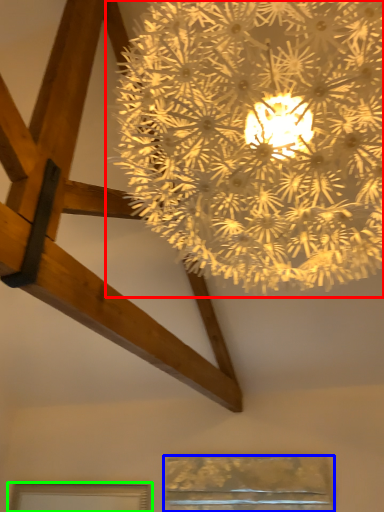
Question: Which is nearer to the lamp (highlighted by a red box)? window (highlighted by a blue box) or window (highlighted by a green box).

Choices:
 (A) window
 (B) window

Answer: (A)